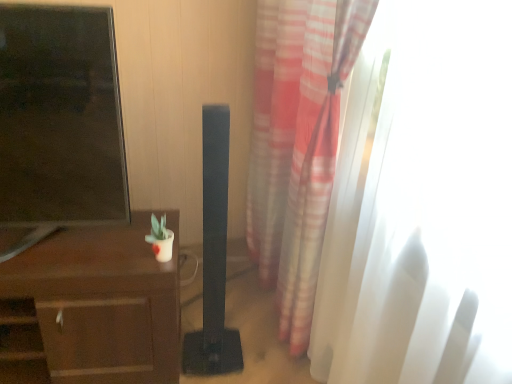
Question: Does brown wood desk at left have a smaller size compared to matte black tv at left?

Choices:
 (A) no
 (B) yes

Answer: (A)

Question: Does brown wood desk at left have a lesser height compared to matte black tv at left?

Choices:
 (A) yes
 (B) no

Answer: (A)

Question: Considering the relative positions of brown wood desk at left and matte black tv at left in the image provided, is brown wood desk at left to the left of matte black tv at left from the viewer's perspective?

Choices:
 (A) no
 (B) yes

Answer: (B)

Question: Is brown wood desk at left thinner than matte black tv at left?

Choices:
 (A) no
 (B) yes

Answer: (A)

Question: From a real-world perspective, is brown wood desk at left physically below matte black tv at left?

Choices:
 (A) yes
 (B) no

Answer: (A)

Question: Would you say brown wood desk at left is outside matte black tv at left?

Choices:
 (A) no
 (B) yes

Answer: (B)

Question: From a real-world perspective, is matte black tv at left on translucent white curtain at right?

Choices:
 (A) yes
 (B) no

Answer: (A)

Question: Considering the relative positions of matte black tv at left and translucent white curtain at right in the image provided, is matte black tv at left to the right of translucent white curtain at right from the viewer's perspective?

Choices:
 (A) no
 (B) yes

Answer: (A)

Question: Is matte black tv at left shorter than translucent white curtain at right?

Choices:
 (A) yes
 (B) no

Answer: (A)

Question: Does matte black tv at left lie behind translucent white curtain at right?

Choices:
 (A) yes
 (B) no

Answer: (A)

Question: From the image's perspective, does matte black tv at left appear higher than translucent white curtain at right?

Choices:
 (A) no
 (B) yes

Answer: (B)

Question: Can you confirm if matte black tv at left is positioned to the left of translucent white curtain at right?

Choices:
 (A) no
 (B) yes

Answer: (B)

Question: Considering the relative positions of brown wood desk at left and translucent white curtain at right in the image provided, is brown wood desk at left to the right of translucent white curtain at right from the viewer's perspective?

Choices:
 (A) no
 (B) yes

Answer: (A)